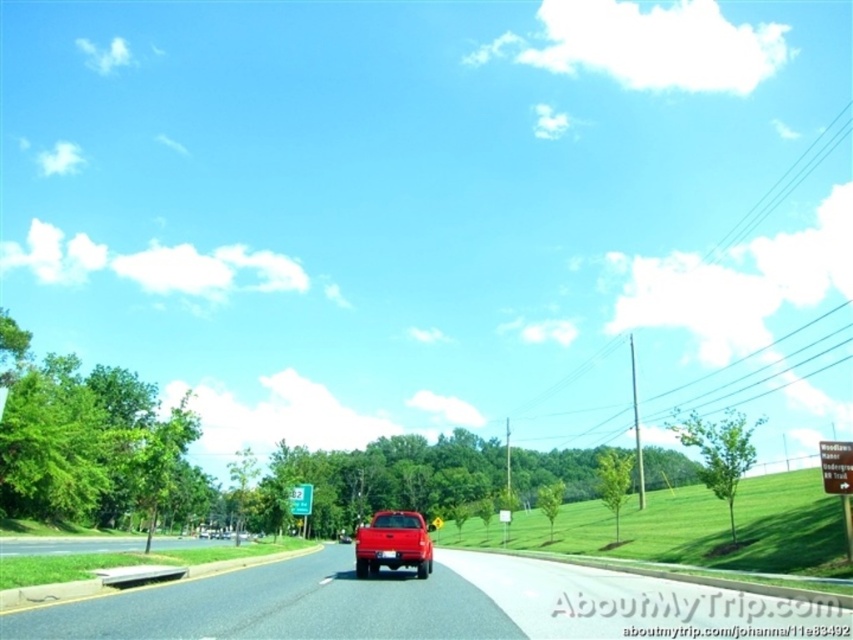
In the scene shown: Who is higher up, glossy red truck at center or green plastic sign at center?

glossy red truck at center is above.

Is glossy red truck at center wider than green plastic sign at center?

Indeed, glossy red truck at center has a greater width compared to green plastic sign at center.

Looking at this image, who is more forward, (605, 609) or (303, 500)?

Point (605, 609)

The width and height of the screenshot is (853, 640). I want to click on glossy red truck at center, so click(410, 604).

Who is more distant from viewer, (625, 611) or (86, 540)?

Positioned behind is point (86, 540).

Where is `glossy red truck at center`? glossy red truck at center is located at coordinates (410, 604).

Locate an element on the screen. The width and height of the screenshot is (853, 640). glossy red truck at center is located at coordinates (410, 604).

Between matte red truck at center and gray asphalt road at lower left, which one appears on the right side from the viewer's perspective?

matte red truck at center

Which is in front, point (393, 524) or point (137, 540)?

Point (393, 524)

Is point (412, 540) positioned in front of point (122, 547)?

Yes, it is in front of point (122, 547).

At what (x,y) coordinates should I click in order to perform the action: click on matte red truck at center. Please return your answer as a coordinate pair (x, y). Looking at the image, I should click on (393, 544).